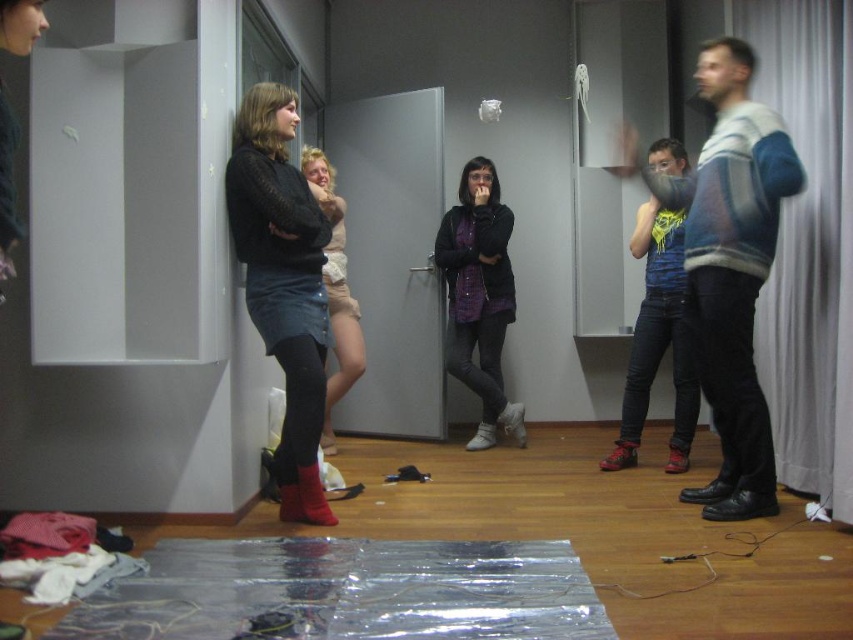
Question: Which point is closer to the camera?

Choices:
 (A) (302, 189)
 (B) (474, 333)

Answer: (A)

Question: Observing the image, what is the correct spatial positioning of matte black sweater at center in reference to leather boot at center?

Choices:
 (A) left
 (B) right

Answer: (A)

Question: Can you confirm if neon yellow mesh tank top at center is positioned below leather boot at center?

Choices:
 (A) yes
 (B) no

Answer: (B)

Question: Based on their relative distances, which object is nearer to the leather boot at lower center?

Choices:
 (A) denim skirt at center
 (B) matte black sweater at center

Answer: (A)

Question: Which object is farther from the camera taking this photo?

Choices:
 (A) matte black sweater at center
 (B) red suede boot at lower center
 (C) matte purple shirt at center
 (D) striped sweater at right

Answer: (C)

Question: Can you confirm if matte black sweater at center is positioned above white suede boot at center?

Choices:
 (A) no
 (B) yes

Answer: (B)